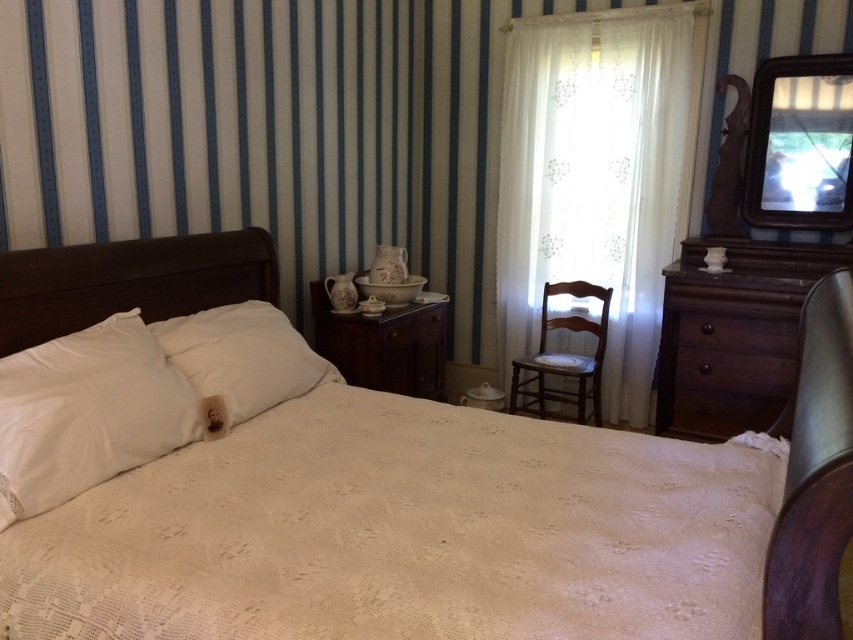
You are standing in the vintage bedroom and want to place a small vase between the two points labeled point (x=695, y=332) and point (x=399, y=326). Based on their positions, which point should the vase be closer to if it needs to be placed in front of the other point?

The vase should be placed closer to point (x=695, y=332) because it is in front of point (x=399, y=326).

You are standing in the vintage bedroom and want to reach the dark wood dresser at right. You notice the white lace curtain at center is in your way. Can you walk around it to get to the dresser?

The white lace curtain at center is further to the viewer than the dark wood dresser at right. Since the curtain is closer to you, it is blocking your path to the dresser. To reach the dresser, you would need to move around the curtain first.

Looking at this image, you are standing in the vintage bedroom and want to place a small vase on the closest object to you between the white lace bedspread at center and the matte wood drawer at center. Which object should you choose?

The white lace bedspread at center is closer to the viewer than the matte wood drawer at center, so you should place the vase on the white lace bedspread at center.